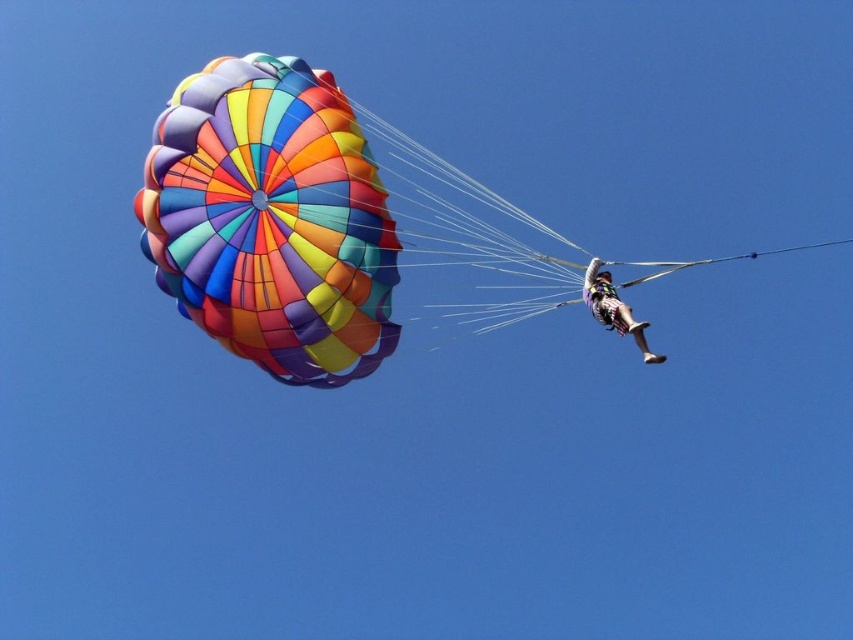
From the picture: You are a safety inspector assessing the parasailing setup. You need to ensure that the two multicolored fabric parachutes are at least 10 meters apart for safety regulations. Are the multicolored fabric parachute at upper left and the multicolored fabric parachute at upper center meeting the safety distance requirement?

The multicolored fabric parachute at upper left and the multicolored fabric parachute at upper center are 10.69 meters apart, which exceeds the required 10 meters, so they meet the safety distance requirement.

Based on the scene description, which multicolored fabric parachute is wider? The multicolored fabric parachute at upper left or the multicolored fabric parachute at upper right?

The multicolored fabric parachute at upper left might be wider than multicolored fabric parachute at upper right according to the description.

You are a photographer trying to capture the parasailers. You notice two multicolored fabric parachutes in the sky. Which one is closer to you, the multicolored fabric parachute at upper left or the multicolored fabric parachute at upper right?

The multicolored fabric parachute at upper left is closer to you because the multicolored fabric parachute at upper right is behind it.